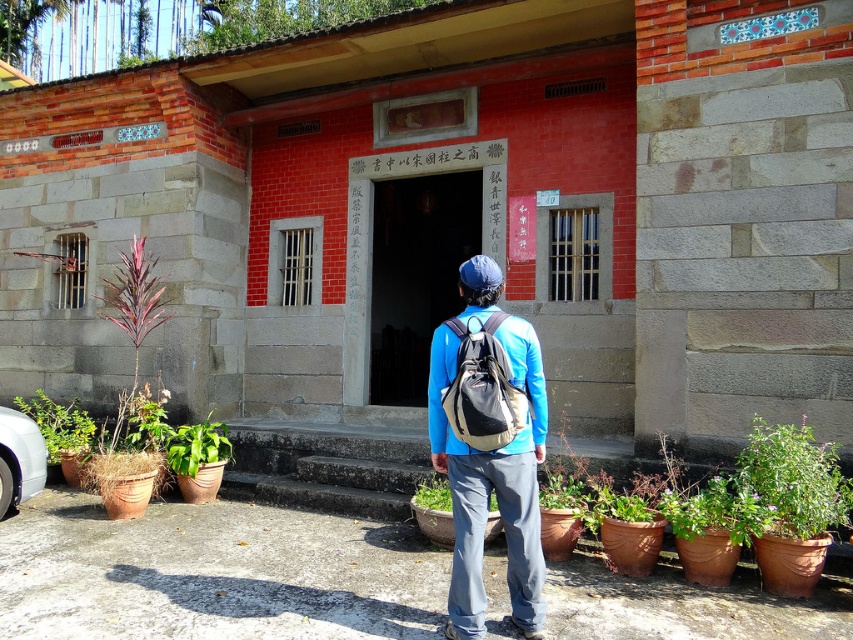
Question: Can you confirm if green leafy plant at lower left is thinner than green matte plant at lower left?

Choices:
 (A) no
 (B) yes

Answer: (A)

Question: Which point is closer to the camera?

Choices:
 (A) matte gray backpack at center
 (B) green matte plant at lower left

Answer: (A)

Question: Which point appears closest to the camera in this image?

Choices:
 (A) (469, 384)
 (B) (28, 472)
 (C) (82, 410)

Answer: (A)

Question: Which point appears farthest from the camera in this image?

Choices:
 (A) click(x=479, y=520)
 (B) click(x=9, y=413)
 (C) click(x=61, y=406)
 (D) click(x=418, y=403)

Answer: (D)

Question: Can you confirm if silver metallic car at lower left is positioned above green leafy plant at lower left?

Choices:
 (A) no
 (B) yes

Answer: (A)

Question: Can you confirm if smooth stone door at center is positioned above green leafy plant at lower right?

Choices:
 (A) yes
 (B) no

Answer: (A)